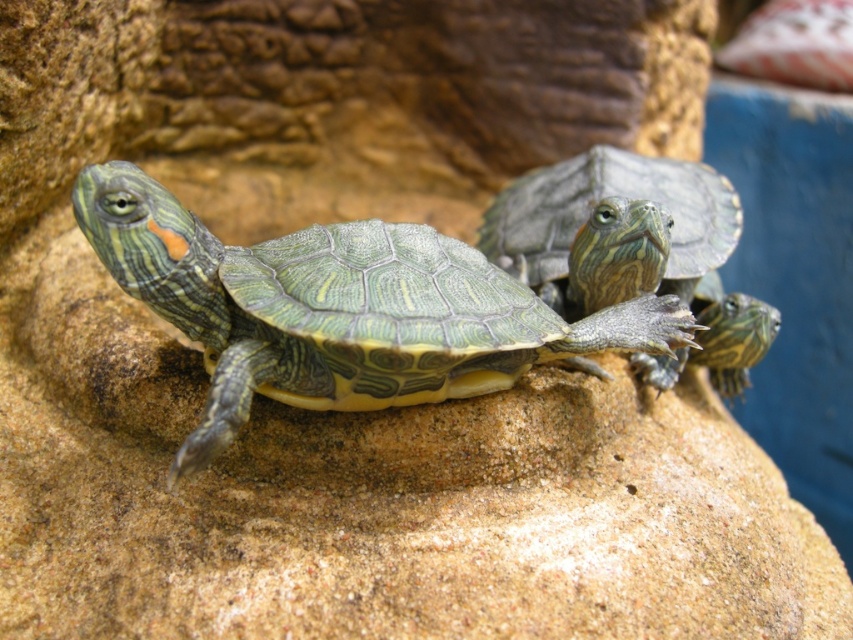
You are a reptile keeper observing the turtles in their enclosure. You notice the green scaly turtle at center and the green textured shell at center. Which object is taller?

The green textured shell at center is taller than the green scaly turtle at center.

You are a small insect observing the scene from above. You notice the green scaly turtle at center and the green textured shell at center. Which one is nearer to you?

The green scaly turtle at center is closer to the viewer than the green textured shell at center.